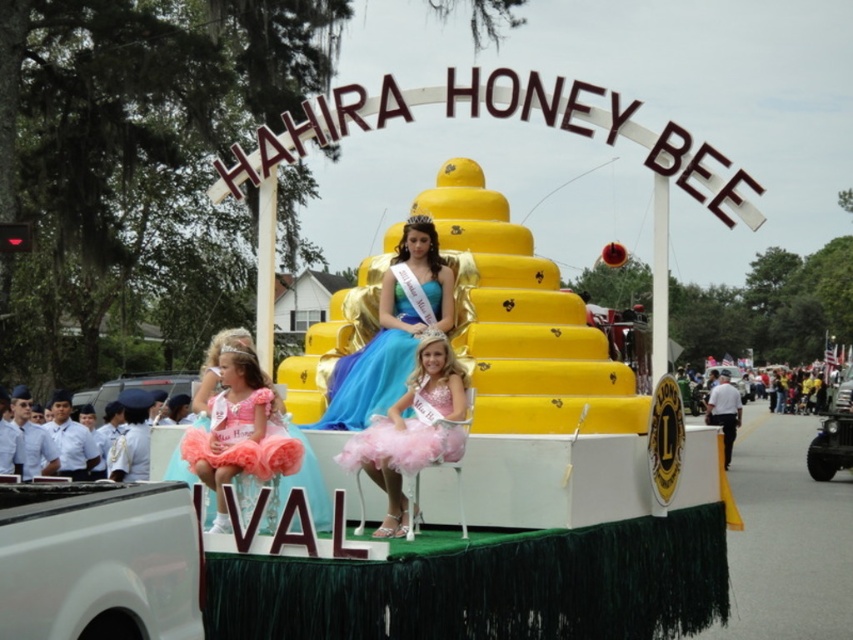
You are standing at the parade watching the Hahira Honey Bee float. There is a point at coordinate point (233,456). Can you reach that point if you can walk 60 meters? Please answer yes or no.

The point at (233,456) is 62.09 meters away from the viewer, so no, you cannot reach it by walking 60 meters.